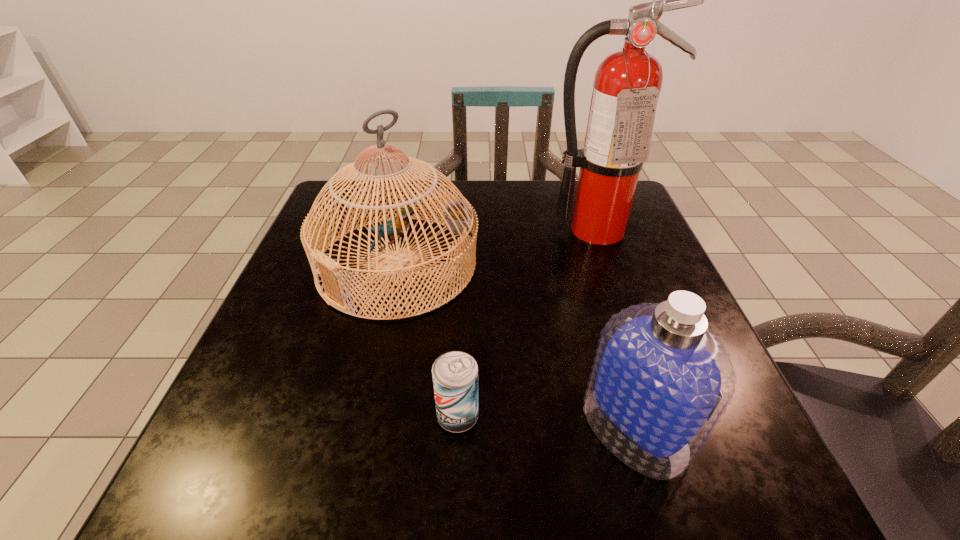
Locate an element on the screen. fire extinguisher is located at coordinates (627, 84).

Locate an element on the screen. The width and height of the screenshot is (960, 540). the third shortest object is located at coordinates (457, 219).

The height and width of the screenshot is (540, 960). Identify the location of cleansing agent. (661, 380).

Where is `beer can`? The width and height of the screenshot is (960, 540). beer can is located at coordinates (455, 374).

This screenshot has height=540, width=960. I want to click on vacant space located on the nozzle side of the fire extinguisher, so click(x=612, y=274).

Locate an element on the screen. The image size is (960, 540). free space located 0.080m on the right of the birdcage is located at coordinates (516, 265).

The width and height of the screenshot is (960, 540). I want to click on blank area located on the back of the cleansing agent, so click(583, 247).

Find the location of a particular element. This screenshot has width=960, height=540. free spot located 0.080m on the back of the beer can is located at coordinates (460, 357).

Where is `fire extinguisher at the far edge`? fire extinguisher at the far edge is located at coordinates 627,84.

Identify the location of birdcage located in the far edge section of the desktop. (457, 219).